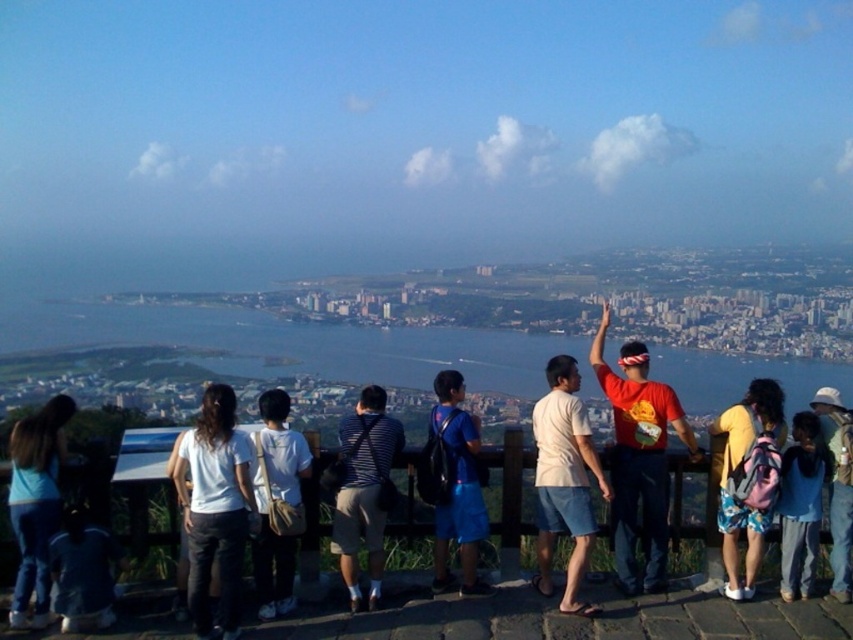
You are standing at the point labeled point at (244, 534) and want to walk to the city center. The city center is located 634.75 meters away from your current position. If you walk at a speed of 1.5 meters per second, how many minutes will it take you to reach the city center?

The distance to the city center is 634.75 meters, and walking at 1.5 meters per second, it would take 634.75 divided by 1.5 equals approximately 423.17 seconds, which converts to about 7.05 minutes. Therefore, it will take roughly 7 minutes to reach the city center.

You are a photographer trying to capture a shot of the cityscape through the spaces between the people at the viewpoint. You notice the denim pants at lower left and the white canvas backpack at center. Which object should you avoid blocking your camera lens to ensure the city view remains visible?

The denim pants at lower left is shorter than the white canvas backpack at center. To avoid blocking the city view, you should ensure the camera lens is positioned above the denim pants at lower left since it is shorter and less likely to obstruct the view compared to the taller white canvas backpack at center.